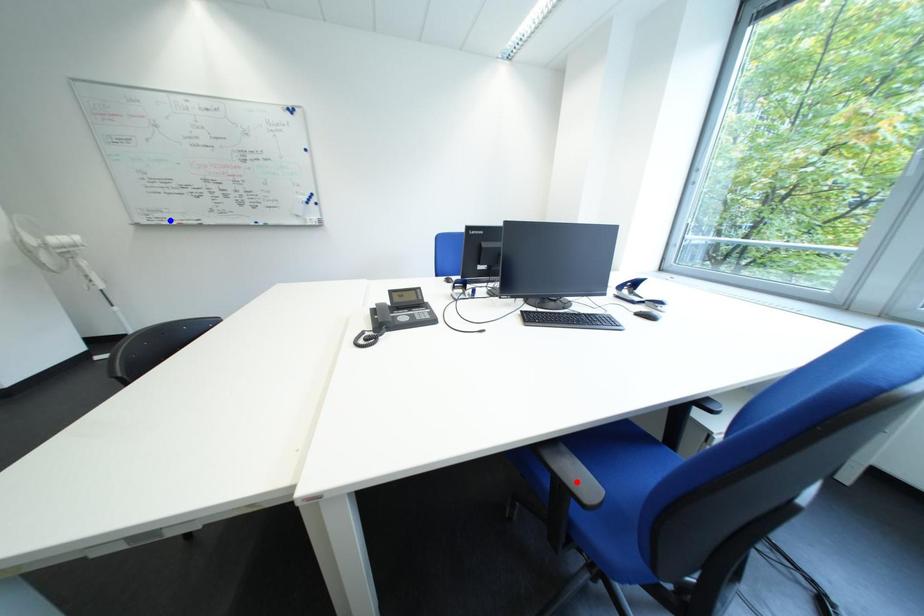
Question: Which of the two points in the image is closer to the camera?

Choices:
 (A) Blue point is closer.
 (B) Red point is closer.

Answer: (B)